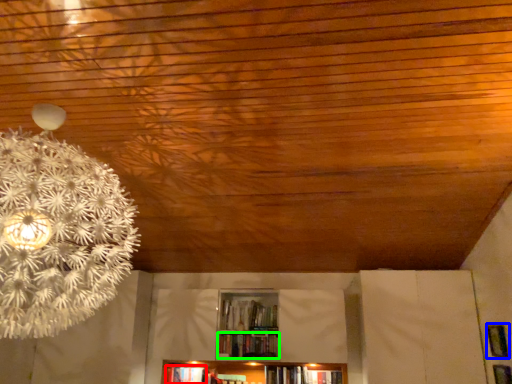
Question: Which object is positioned closest to book (highlighted by a red box)? Select from panel (highlighted by a blue box) and book (highlighted by a green box).

Choices:
 (A) panel
 (B) book

Answer: (B)